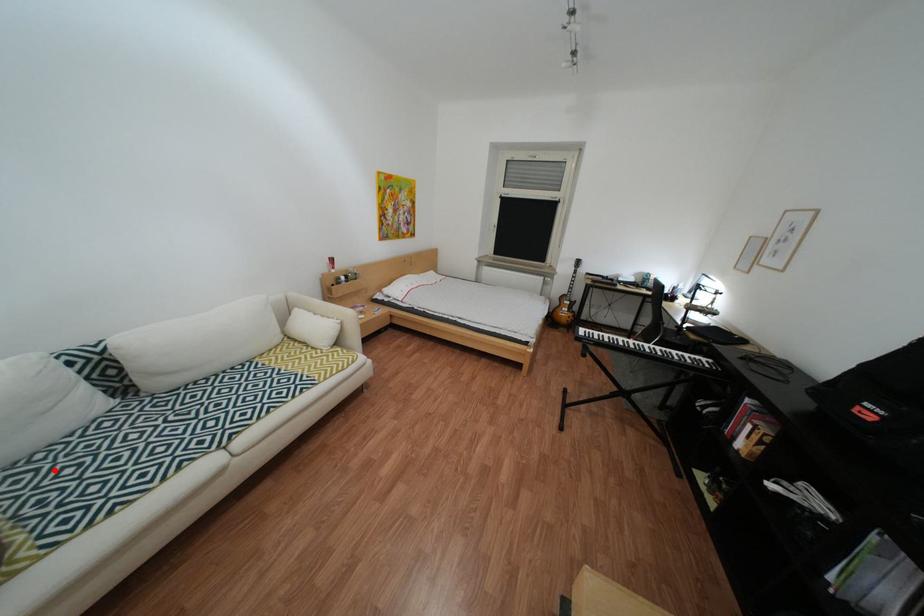
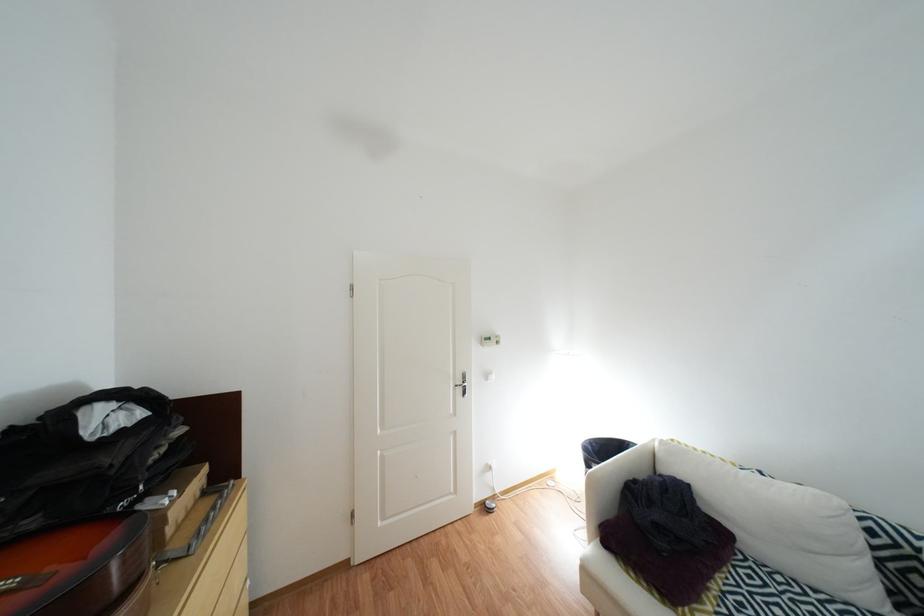
Question: I am providing you with two images of the same scene from different viewpoints. In image1, a red point is highlighted. Considering the same 3D point in image2, which of the following is correct?

Choices:
 (A) It is closer
 (B) It is farther

Answer: (A)